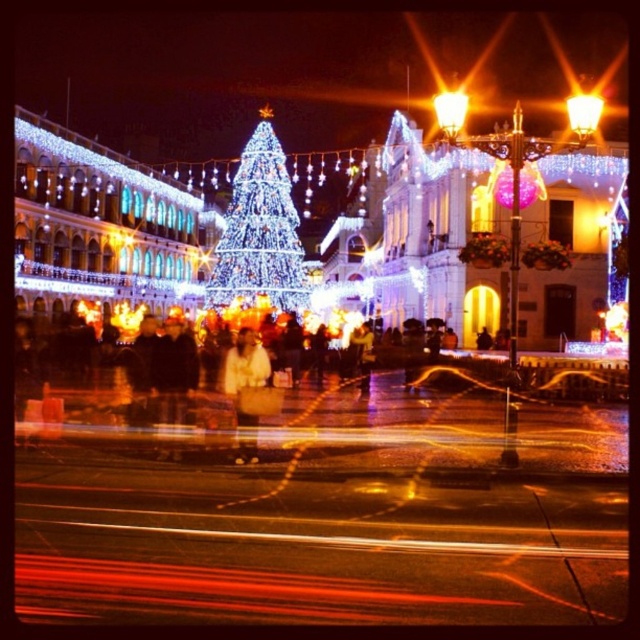
You are standing at the center of the square and want to take a photo of the illuminated glass christmas tree at center. If you move 0.2 units to the north, will you still be able to see the tree in your view?

The illuminated glass christmas tree at center is located at point (259, 237). Moving 0.2 units north would place you at a new position, but since the tree is centrally positioned, you would still be able to see it in your view.

You are standing in the square and want to take a photo of both the illuminated glass christmas tree at center and the matte gold streetlight at upper right. Which object should you position closer to the left side of your camera frame to include both in the photo?

You should position the illuminated glass christmas tree at center closer to the left side of your camera frame because it is already to the left of the matte gold streetlight at upper right.